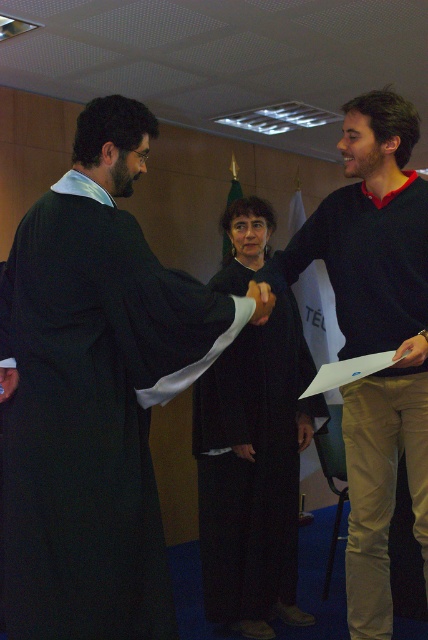
Can you confirm if black matte sweater at right is taller than black matte robe at center?

Indeed, black matte sweater at right has a greater height compared to black matte robe at center.

Which is more to the left, black matte sweater at right or black matte robe at center?

black matte robe at center

The width and height of the screenshot is (428, 640). Identify the location of black matte sweater at right. (374, 333).

The width and height of the screenshot is (428, 640). Find the location of `black matte sweater at right`. black matte sweater at right is located at coordinates (374, 333).

Can you confirm if matte black robe at left is bigger than black matte sweater at right?

Incorrect, matte black robe at left is not larger than black matte sweater at right.

Can you confirm if matte black robe at left is wider than black matte sweater at right?

Yes.

Is point (71, 243) closer to camera compared to point (407, 260)?

That is True.

At what (x,y) coordinates should I click in order to perform the action: click on matte black robe at left. Please return your answer as a coordinate pair (x, y). The image size is (428, 640). Looking at the image, I should click on (92, 413).

Is matte black robe at left shorter than black matte robe at center?

Correct, matte black robe at left is not as tall as black matte robe at center.

Between point (137, 596) and point (225, 388), which one is positioned in front?

Positioned in front is point (137, 596).

What are the coordinates of `matte black robe at left` in the screenshot? It's located at (92, 413).